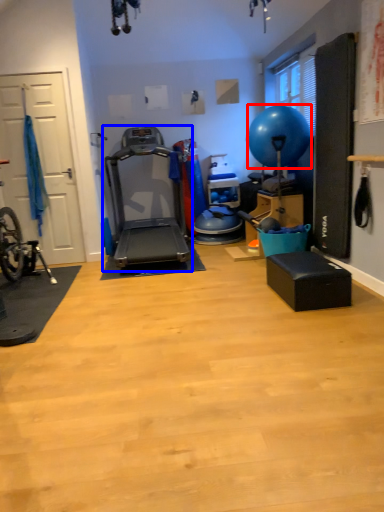
Question: Which object appears closest to the camera in this image, balloon (highlighted by a red box) or treadmill (highlighted by a blue box)?

Choices:
 (A) balloon
 (B) treadmill

Answer: (B)